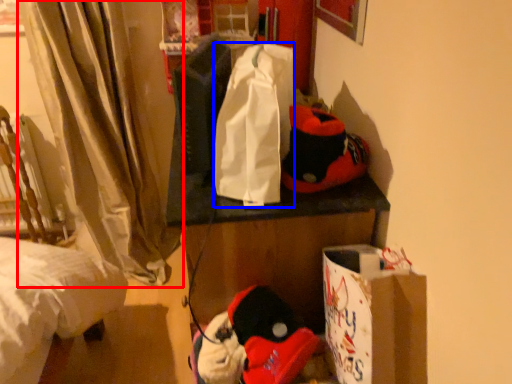
Question: Which of the following is the farthest to the observer, curtain (highlighted by a red box) or tote bag (highlighted by a blue box)?

Choices:
 (A) curtain
 (B) tote bag

Answer: (A)